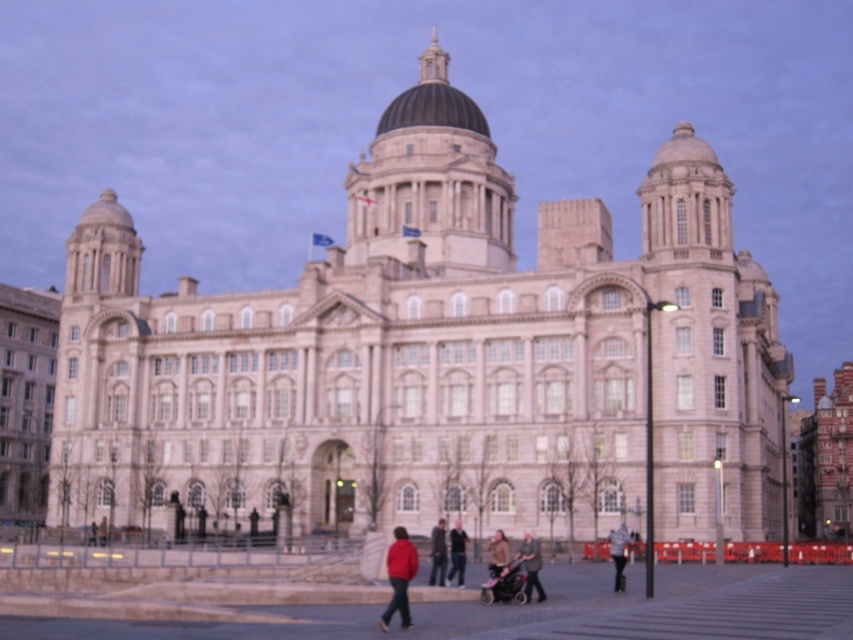
You are a photographer trying to capture a wide shot of the historic building. You notice the pink fabric stroller at lower center and the red jacket at center in your frame. Considering their widths, which object would require more space in the photo to avoid being cut off?

The pink fabric stroller at lower center has a greater width than the red jacket at center, so it would require more space in the photo to avoid being cut off.

You are a photographer standing at the front of the grand historic building. You want to capture a photo that includes both the pink fabric stroller at lower center and the brown leather jacket at center. Which object should you zoom in on to ensure both are clearly visible in the frame?

The pink fabric stroller at lower center is smaller than the brown leather jacket at center. To ensure both are clearly visible, you should zoom in on the pink fabric stroller at lower center since it is smaller and might require closer focus to capture details without the larger object overwhelming the frame.

You are standing in front of the historic building and want to take a photo of the central dome. There is a pink fabric stroller at lower center and a matte red jacket at center in your way. Which object should you move to get a clear view of the dome?

You should move the pink fabric stroller at lower center because it is closer to the viewer than the matte red jacket at center, so removing it would provide a clearer path to the central dome.